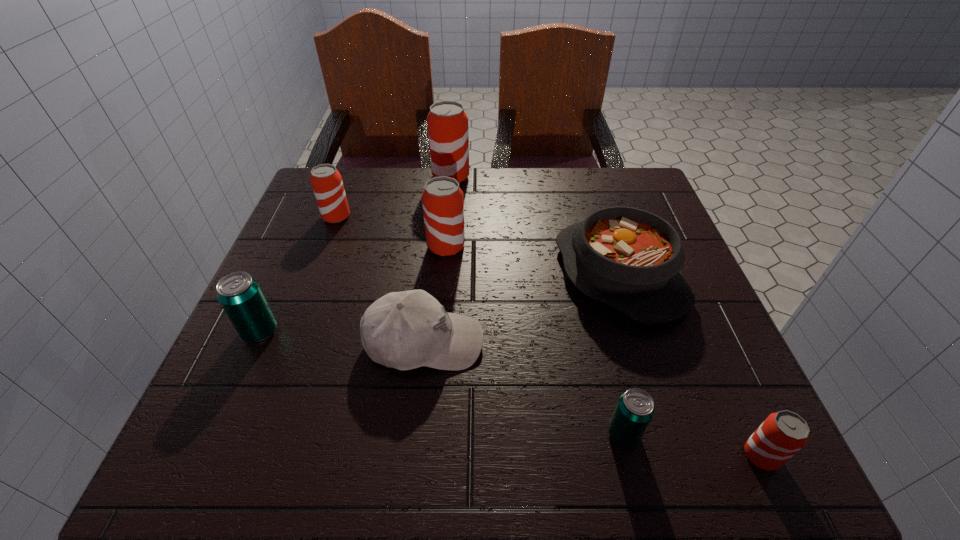
Where is `vacant region that satisfies the following two spatial constraints: 1. on the front side of the second tallest beer can; 2. on the right side of the rightmost beer can`? This screenshot has height=540, width=960. vacant region that satisfies the following two spatial constraints: 1. on the front side of the second tallest beer can; 2. on the right side of the rightmost beer can is located at coordinates pos(429,455).

This screenshot has width=960, height=540. In order to click on blank space that satisfies the following two spatial constraints: 1. on the front side of the second biggest orange beer can; 2. on the right side of the gray casserole in this screenshot , I will do `click(444, 274)`.

At what (x,y) coordinates should I click in order to perform the action: click on free location that satisfies the following two spatial constraints: 1. on the back side of the rightmost orange beer can; 2. on the front-facing side of the gray baseball cap. Please return your answer as a coordinate pair (x, y). This screenshot has width=960, height=540. Looking at the image, I should click on (709, 342).